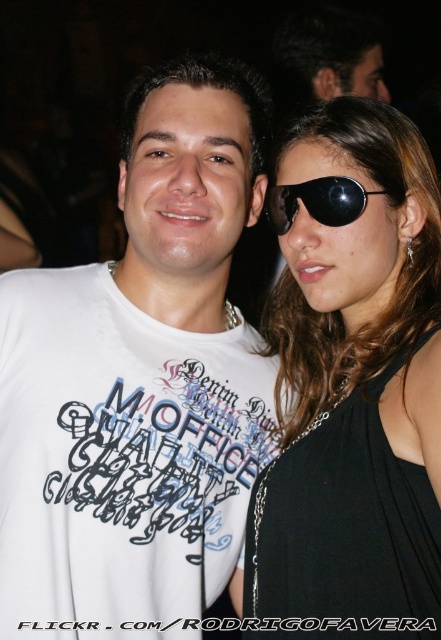
From the picture: Does white matte t-shirt at center appear on the right side of black matte sunglasses at upper right?

Incorrect, white matte t-shirt at center is not on the right side of black matte sunglasses at upper right.

What do you see at coordinates (139, 384) in the screenshot? I see `white matte t-shirt at center` at bounding box center [139, 384].

This screenshot has width=441, height=640. What are the coordinates of `white matte t-shirt at center` in the screenshot? It's located at (139, 384).

Between black matte sunglasses at upper right and black plastic goggles at upper right, which one appears on the right side from the viewer's perspective?

Positioned to the right is black matte sunglasses at upper right.

Between black matte sunglasses at upper right and black plastic goggles at upper right, which one has less height?

Standing shorter between the two is black plastic goggles at upper right.

Does point (362, 248) lie in front of point (306, 189)?

Yes.

Identify the location of black matte sunglasses at upper right. This screenshot has height=640, width=441. (352, 385).

This screenshot has height=640, width=441. What are the coordinates of `white matte t-shirt at center` in the screenshot? It's located at (139, 384).